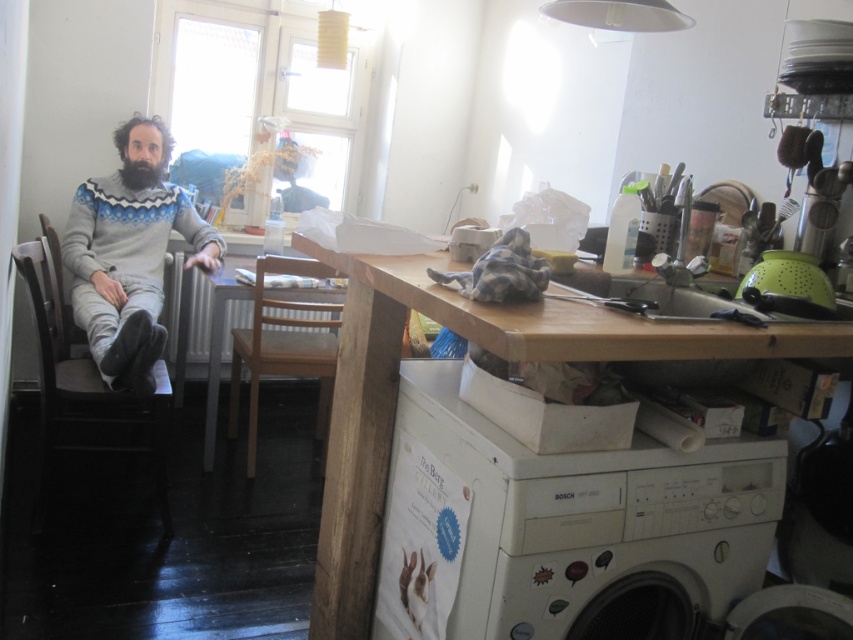
Is gray fabric chair at left closer to the viewer compared to wooden chair at center?

Yes, gray fabric chair at left is closer to the viewer.

Is point (134, 429) positioned before point (335, 317)?

Yes.

Which is in front, point (55, 296) or point (306, 317)?

Point (55, 296) is more forward.

In order to click on gray fabric chair at left in this screenshot , I will do `click(84, 392)`.

Between white plastic washing machine at lower right and wooden chair at center, which one is positioned lower?

white plastic washing machine at lower right is lower down.

Can you confirm if white plastic washing machine at lower right is positioned below wooden chair at center?

Yes.

Where is `white plastic washing machine at lower right`? The width and height of the screenshot is (853, 640). white plastic washing machine at lower right is located at coordinates (561, 529).

From the picture: Who is positioned more to the left, knitted sweater at left or wooden chair at center?

knitted sweater at left is more to the left.

Does knitted sweater at left have a lesser height compared to wooden chair at center?

In fact, knitted sweater at left may be taller than wooden chair at center.

Which is behind, point (136, 316) or point (280, 262)?

The point (280, 262) is more distant.

Locate an element on the screen. knitted sweater at left is located at coordinates (131, 253).